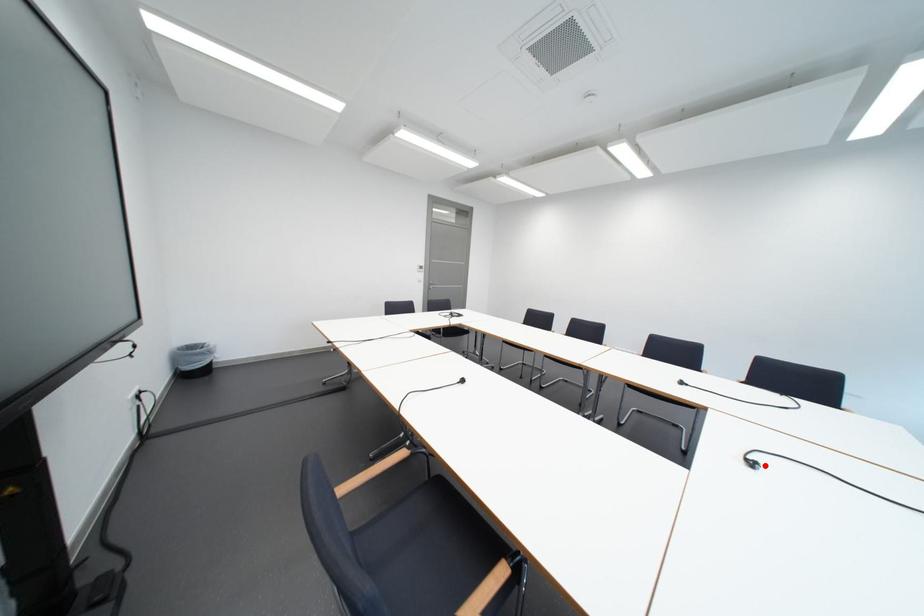
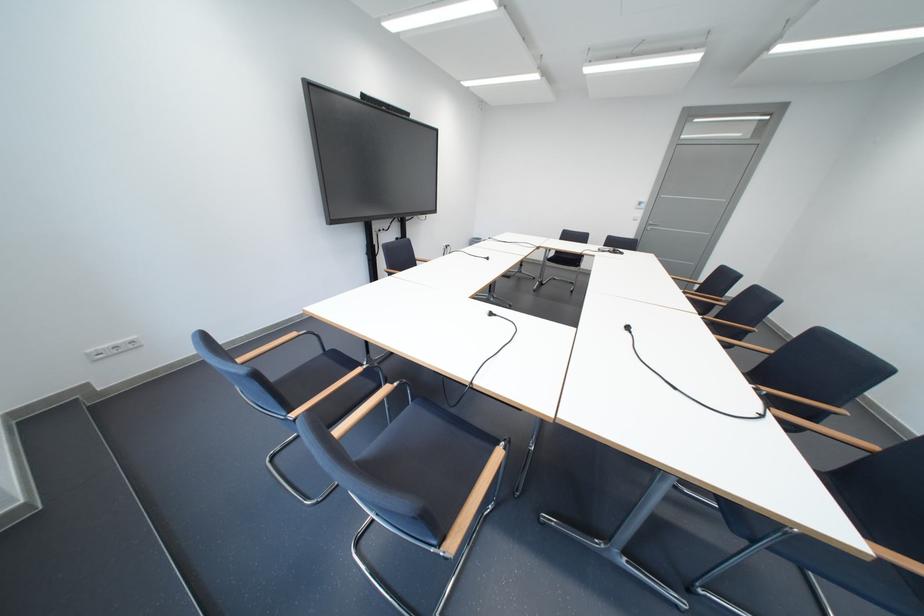
The point at the highlighted location is marked in the first image. Where is the corresponding point in the second image?

(503, 315)